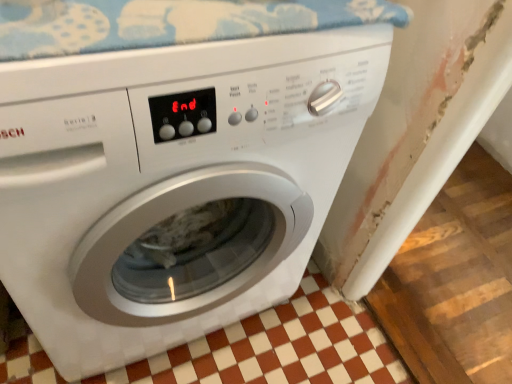
What do you see at coordinates (172, 183) in the screenshot?
I see `white glossy washing machine at center` at bounding box center [172, 183].

Find the location of a particular element. The height and width of the screenshot is (384, 512). white glossy washing machine at center is located at coordinates (172, 183).

This screenshot has height=384, width=512. I want to click on white glossy washing machine at center, so click(x=172, y=183).